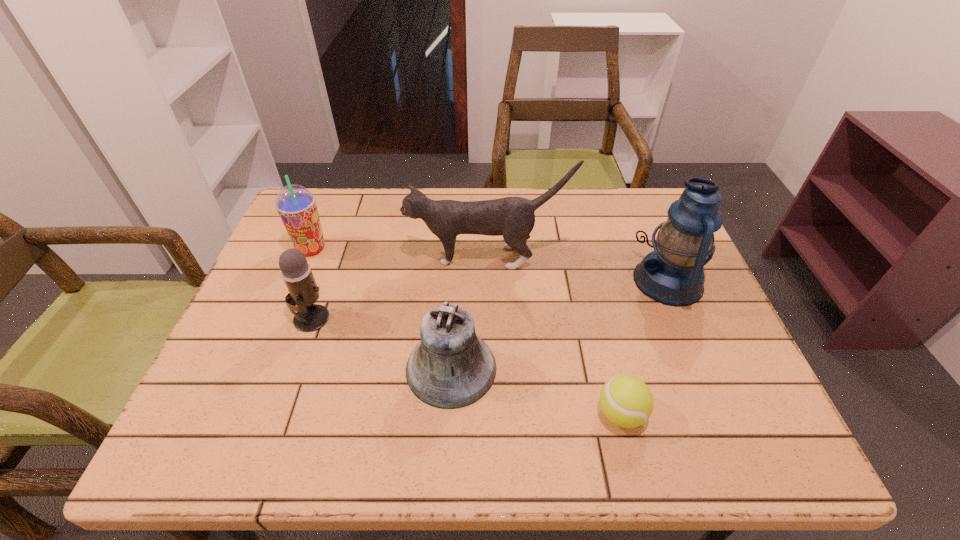
You are a GUI agent. You are given a task and a screenshot of the screen. Output one action in this format:
    pyautogui.click(x=<x>, y=<y>)
    Task: Click on the blank region between the bell and the lantern
    This screenshot has height=540, width=960.
    Given the screenshot: What is the action you would take?
    pyautogui.click(x=560, y=325)

The height and width of the screenshot is (540, 960). What are the coordinates of `vacant space that's between the rightmost object and the bell` in the screenshot? It's located at (560, 325).

Locate an element on the screen. This screenshot has height=540, width=960. the fourth closest object relative to the microphone is located at coordinates (625, 400).

Where is `object that stands as the fourth closest to the microphone`? object that stands as the fourth closest to the microphone is located at coordinates (625, 400).

Locate an element on the screen. vacant point that satisfies the following two spatial constraints: 1. on the front side of the microphone; 2. on the left side of the bell is located at coordinates (294, 368).

Identify the location of free space in the image that satisfies the following two spatial constraints: 1. at the face of the cat; 2. on the front side of the microphone. The width and height of the screenshot is (960, 540). (488, 318).

You are a GUI agent. You are given a task and a screenshot of the screen. Output one action in this format:
    pyautogui.click(x=<x>, y=<y>)
    Task: Click on the vacant space that satisfies the following two spatial constraints: 1. on the front side of the bell; 2. on the left side of the microphone
    The height and width of the screenshot is (540, 960).
    Given the screenshot: What is the action you would take?
    pyautogui.click(x=294, y=368)